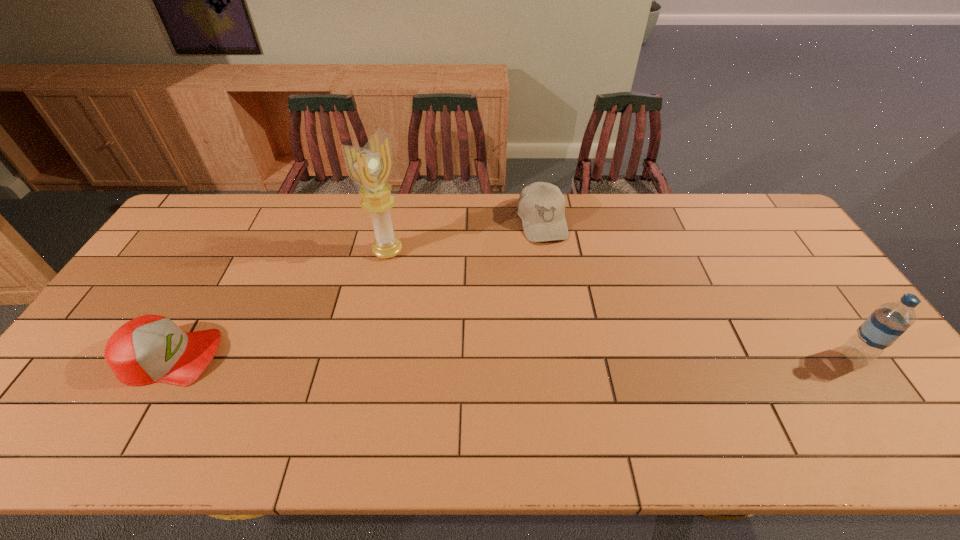
Identify the location of the nearer baseball cap. Image resolution: width=960 pixels, height=540 pixels. tap(151, 348).

Where is `the leftmost object`? the leftmost object is located at coordinates (151, 348).

Identify the location of water bottle. The image size is (960, 540). (885, 325).

You are a GUI agent. You are given a task and a screenshot of the screen. Output one action in this format:
    pyautogui.click(x=<x>, y=<y>)
    Task: Click on the rightmost object
    
    Given the screenshot: What is the action you would take?
    pyautogui.click(x=885, y=325)

Where is `award`? The width and height of the screenshot is (960, 540). award is located at coordinates (371, 167).

Locate an element on the screen. the tallest object is located at coordinates (371, 167).

Where is `the farther baseball cap`? the farther baseball cap is located at coordinates (541, 206).

Image resolution: width=960 pixels, height=540 pixels. In order to click on the second object from right to left in this screenshot , I will do `click(541, 206)`.

Identify the location of free space located on the front-facing side of the left baseball cap. The image size is (960, 540). (304, 356).

This screenshot has width=960, height=540. In order to click on vacant area located 0.170m on the front-facing side of the award in this screenshot , I will do `click(438, 287)`.